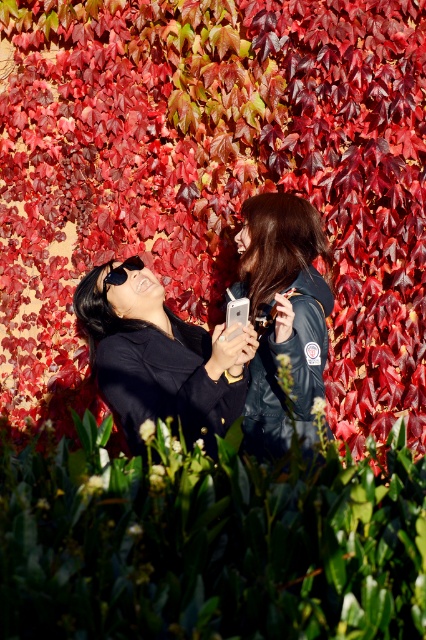
Question: Is dark green leather jacket at center wider than black matte goggles at upper left?

Choices:
 (A) yes
 (B) no

Answer: (A)

Question: Does shiny red leaves at upper center have a larger size compared to dark green leather jacket at center?

Choices:
 (A) no
 (B) yes

Answer: (B)

Question: Which point is closer to the camera?

Choices:
 (A) shiny red leaves at upper center
 (B) matte black jacket at center
 (C) dark green leather jacket at center
 (D) black matte goggles at upper left

Answer: (B)

Question: Which point is closer to the camera?

Choices:
 (A) (304, 328)
 (B) (241, 358)

Answer: (B)

Question: Which point appears farthest from the camera in this image?

Choices:
 (A) (291, 253)
 (B) (144, 250)
 (C) (115, 282)

Answer: (B)

Question: Is matte black jacket at center to the right of dark green leather jacket at center from the viewer's perspective?

Choices:
 (A) yes
 (B) no

Answer: (B)